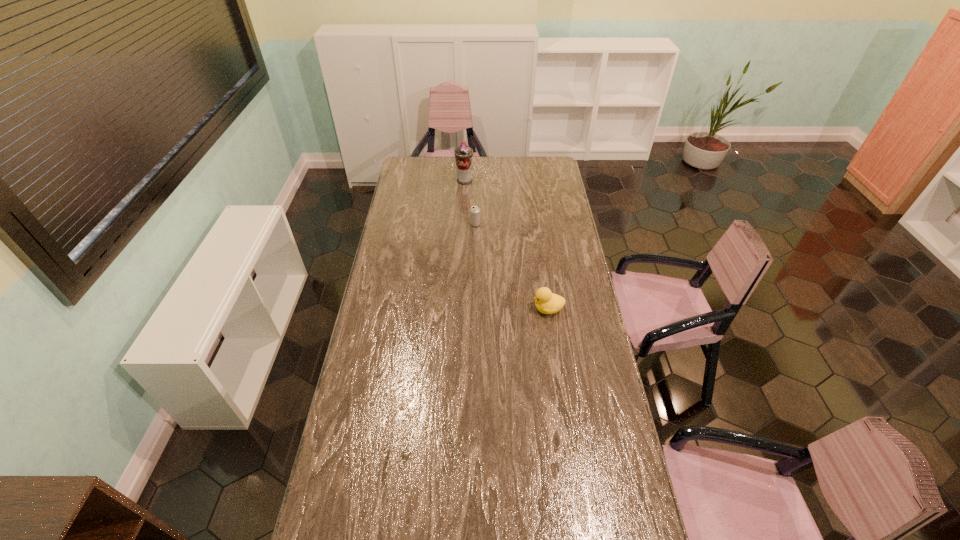
The width and height of the screenshot is (960, 540). In order to click on the tallest object in this screenshot , I will do `click(463, 154)`.

This screenshot has height=540, width=960. I want to click on aerosol can, so click(x=463, y=154).

The width and height of the screenshot is (960, 540). I want to click on the nearest object, so click(x=546, y=302).

At what (x,y) coordinates should I click in order to perform the action: click on duck. Please return your answer as a coordinate pair (x, y). The height and width of the screenshot is (540, 960). Looking at the image, I should click on (546, 302).

At what (x,y) coordinates should I click in order to perform the action: click on the shortest object. Please return your answer as a coordinate pair (x, y). Looking at the image, I should click on (474, 210).

This screenshot has width=960, height=540. I want to click on the second nearest object, so click(474, 210).

Image resolution: width=960 pixels, height=540 pixels. What are the coordinates of `free space located 0.130m on the back of the aerosol can` in the screenshot? It's located at (466, 164).

This screenshot has width=960, height=540. In order to click on vacant region located on the front-facing side of the rightmost object in this screenshot , I will do `click(499, 309)`.

Find the location of a particular element. free point located on the front-facing side of the rightmost object is located at coordinates (477, 309).

Locate an element on the screen. This screenshot has width=960, height=540. vacant space positioned on the front-facing side of the rightmost object is located at coordinates (494, 309).